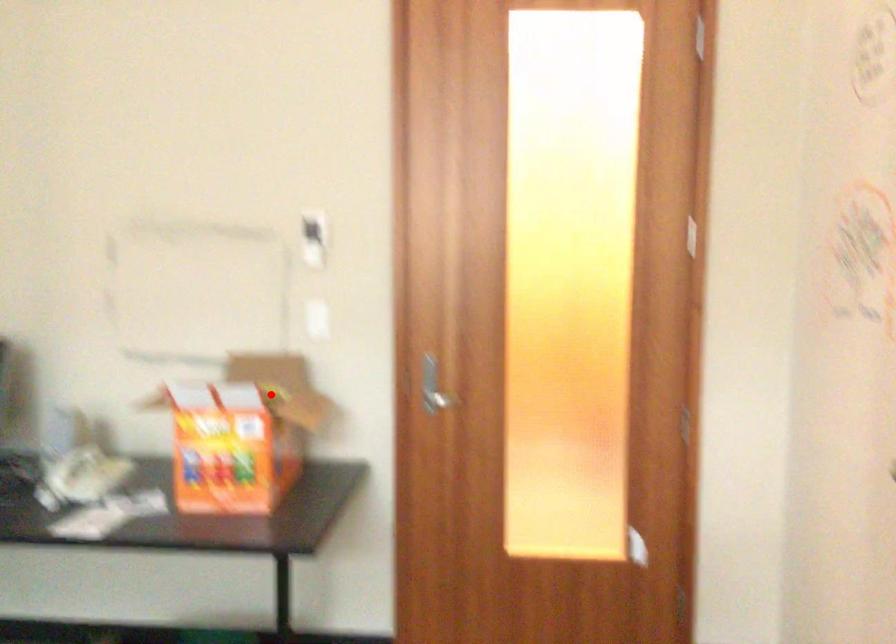
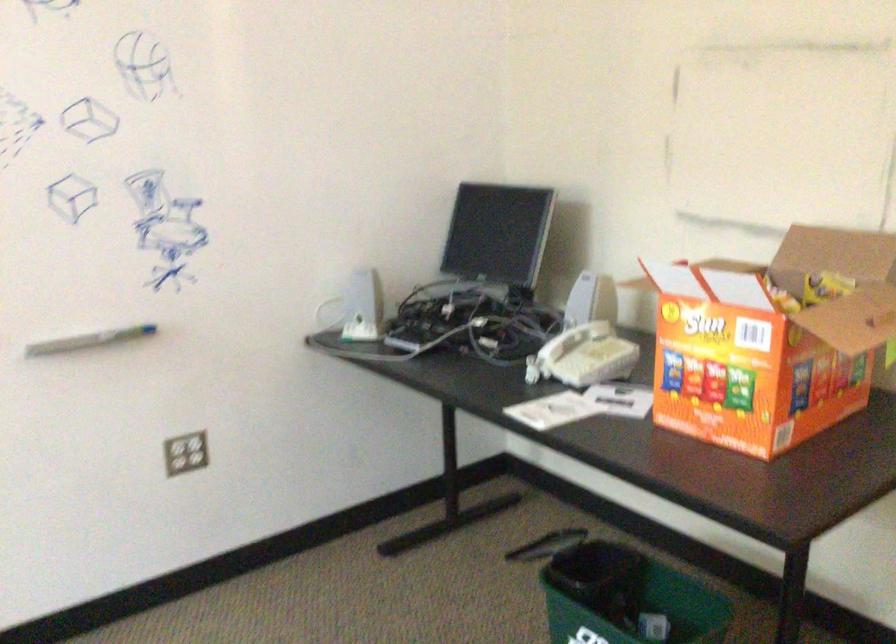
Question: I am providing you with two images of the same scene from different viewpoints. A red point is marked on the first image. At the location where the point appears in image 1, is it still visible in image 2?

Choices:
 (A) Yes
 (B) No

Answer: (A)